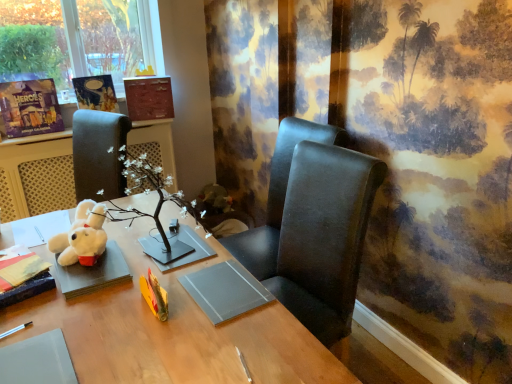
Find the location of a particular element. This screenshot has height=384, width=512. white plush toy at left is located at coordinates (74, 165).

What do you see at coordinates (74, 165) in the screenshot? The height and width of the screenshot is (384, 512). I see `white plush toy at left` at bounding box center [74, 165].

In the scene shown: What is the approximate height of black leather chair at center, which is counted as the 1th chair, starting from the bottom?

The height of black leather chair at center, which is counted as the 1th chair, starting from the bottom, is 3.40 feet.

Describe the element at coordinates (96, 93) in the screenshot. Image resolution: width=512 pixels, height=384 pixels. I see `matte paper book at upper left, the second book positioned from the top` at that location.

Identify the location of wooden desk at center. The image size is (512, 384). (173, 331).

Find the location of a particular element. Image resolution: width=512 pixels, height=384 pixels. white plush toy at left is located at coordinates (74, 165).

From a real-world perspective, is matte black book at lower left, which ranks as the fourth book in top-to-bottom order, over white plush toy at left?

Yes.

Based on their sizes in the image, would you say matte black book at lower left, which is the 1th book from bottom to top, is bigger or smaller than white plush toy at left?

In the image, matte black book at lower left, which is the 1th book from bottom to top, appears to be smaller than white plush toy at left.

From the image's perspective, is matte black book at lower left, which ranks as the fourth book in top-to-bottom order, below white plush toy at left?

Yes, from the image's perspective, matte black book at lower left, which ranks as the fourth book in top-to-bottom order, is below white plush toy at left.

Measure the distance between matte black book at lower left, which is the 1th book from bottom to top, and white plush toy at left.

matte black book at lower left, which is the 1th book from bottom to top, is 1.62 meters from white plush toy at left.

Is black leather chair at center, which is counted as the 1th chair, starting from the bottom, to the right of white plush toy at lower left from the viewer's perspective?

Yes, black leather chair at center, which is counted as the 1th chair, starting from the bottom, is to the right of white plush toy at lower left.

From the image's perspective, which is above, black leather chair at center, acting as the second chair starting from the top, or white plush toy at lower left?

white plush toy at lower left is shown above in the image.

Find the location of `toy that is behind the black leather chair at center, which is counted as the 1th chair, starting from the bottom`. toy that is behind the black leather chair at center, which is counted as the 1th chair, starting from the bottom is located at coordinates (81, 235).

Is black leather chair at center, acting as the second chair starting from the top, shorter than white plush toy at lower left?

In fact, black leather chair at center, acting as the second chair starting from the top, may be taller than white plush toy at lower left.

From a real-world perspective, is matte black chair at center, which is the second chair in bottom-to-top order, on wooden desk at center?

Correct, in the physical world, matte black chair at center, which is the second chair in bottom-to-top order, is higher than wooden desk at center.

From the image's perspective, count 2nd chairs upward from the wooden desk at center and point to it. Please provide its 2D coordinates.

[(278, 196)]

Is the depth of matte black chair at center, which is the second chair in bottom-to-top order, greater than that of wooden desk at center?

Yes, it is.

Is matte black chair at center, which is the second chair in bottom-to-top order, oriented towards wooden desk at center?

Yes, matte black chair at center, which is the second chair in bottom-to-top order, is aimed at wooden desk at center.

I want to click on toy located on the left of matte black chair at center, which is the 1th chair in top-to-bottom order, so click(x=81, y=235).

Considering the positions of points (98, 247) and (274, 164), is point (98, 247) farther from camera compared to point (274, 164)?

No, (98, 247) is in front of (274, 164).

Would you say white plush toy at lower left is outside matte black chair at center, which is the second chair in bottom-to-top order?

Yes, white plush toy at lower left is not within matte black chair at center, which is the second chair in bottom-to-top order.

From the image's perspective, relative to matte black chair at center, which is the second chair in bottom-to-top order, is white plush toy at lower left above or below?

white plush toy at lower left is situated lower than matte black chair at center, which is the second chair in bottom-to-top order, in the image.

Can you confirm if matte paper book at upper left, which is counted as the second book, starting from the back, is shorter than white plush toy at lower left?

No, matte paper book at upper left, which is counted as the second book, starting from the back, is not shorter than white plush toy at lower left.

Considering the points (103, 101) and (101, 238), which point is in front, point (103, 101) or point (101, 238)?

The point (101, 238) is closer to the camera.

Is matte paper book at upper left, arranged as the 3th book when viewed from the front, oriented towards white plush toy at lower left?

Yes, matte paper book at upper left, arranged as the 3th book when viewed from the front, faces towards white plush toy at lower left.

In the scene shown: Looking at their sizes, would you say matte paper book at upper left, which is counted as the second book, starting from the back, is wider or thinner than white plush toy at lower left?

In the image, matte paper book at upper left, which is counted as the second book, starting from the back, appears to be more narrow than white plush toy at lower left.

Is black leather chair at center, which is counted as the 1th chair, starting from the bottom, closer to the viewer compared to white plush toy at left?

Yes, it is.

Is black leather chair at center, acting as the second chair starting from the top, looking in the opposite direction of white plush toy at left?

No, black leather chair at center, acting as the second chair starting from the top, is not facing the opposite direction of white plush toy at left.

Locate an element on the screen. The image size is (512, 384). table located above the black leather chair at center, which is counted as the 1th chair, starting from the bottom (from a real-world perspective) is located at coordinates (74, 165).

Considering the relative sizes of black leather chair at center, acting as the second chair starting from the top, and white plush toy at left in the image provided, is black leather chair at center, acting as the second chair starting from the top, taller than white plush toy at left?

Correct, black leather chair at center, acting as the second chair starting from the top, is much taller as white plush toy at left.

Consider the image. Considering the relative positions of wooden desk at center and matte black book at lower left, arranged as the 1th book when viewed from the front, in the image provided, is wooden desk at center to the left or to the right of matte black book at lower left, arranged as the 1th book when viewed from the front,?

In the image, wooden desk at center appears on the right side of matte black book at lower left, arranged as the 1th book when viewed from the front.

In the scene shown: Is wooden desk at center next to matte black book at lower left, which is the 1th book from bottom to top?

wooden desk at center is not next to matte black book at lower left, which is the 1th book from bottom to top, and they're not touching.

Is wooden desk at center positioned with its back to matte black book at lower left, acting as the 4th book starting from the back?

No.

Locate an element on the screen. table directly beneath the matte black book at lower left, arranged as the 1th book when viewed from the front (from a real-world perspective) is located at coordinates (74, 165).

Starting from the white plush toy at lower left, which chair is the 2nd one to the right? Please provide its 2D coordinates.

[(324, 236)]

Based on their spatial positions, is white plush toy at lower left or matte black book at lower left, which is the 1th book from bottom to top, closer to wooden desk at center?

white plush toy at lower left.

Considering their positions, is matte paper book at upper left, arranged as the 3th book when viewed from the front, positioned closer to white plush toy at lower left than matte cardboard book at upper left, arranged as the third book when viewed from the back?

Among the two, matte cardboard book at upper left, arranged as the third book when viewed from the back, is located nearer to white plush toy at lower left.

From the image, which object appears to be nearer to white plush toy at left, black leather chair at center, which is counted as the 1th chair, starting from the bottom, or white plush toy at lower left?

white plush toy at lower left.

Estimate the real-world distances between objects in this image. Which object is closer to matte black chair at center, which is the 1th chair in top-to-bottom order, matte paper book at upper left, which is counted as the second book, starting from the back, or matte black book at lower left, which ranks as the fourth book in top-to-bottom order?

matte black book at lower left, which ranks as the fourth book in top-to-bottom order, is positioned closer to the anchor matte black chair at center, which is the 1th chair in top-to-bottom order.

From the image, which object appears to be farther from black leather chair at center, which is counted as the 1th chair, starting from the bottom, white plush toy at left or wooden desk at center?

Based on the image, white plush toy at left appears to be further to black leather chair at center, which is counted as the 1th chair, starting from the bottom.

Looking at the image, which one is located further to matte black chair at center, which is the second chair in bottom-to-top order, matte brown book at upper center, the first book viewed from the back, or black leather chair at center, acting as the second chair starting from the top?

Based on the image, matte brown book at upper center, the first book viewed from the back, appears to be further to matte black chair at center, which is the second chair in bottom-to-top order.

Based on their spatial positions, is matte brown book at upper center, the 4th book from the bottom, or black leather chair at center, acting as the second chair starting from the top, closer to matte paper book at upper left, the second book positioned from the top?

matte brown book at upper center, the 4th book from the bottom.

In the scene shown: Looking at the image, which one is located closer to matte cardboard book at upper left, marked as the second book in a front-to-back arrangement, white plush toy at lower left or black leather chair at center, acting as the second chair starting from the top?

Based on the image, white plush toy at lower left appears to be nearer to matte cardboard book at upper left, marked as the second book in a front-to-back arrangement.

At what (x,y) coordinates should I click in order to perform the action: click on chair between matte black book at lower left, arranged as the 1th book when viewed from the front, and matte paper book at upper left, which is counted as the 3th book, starting from the bottom, in the front-back direction. Please return your answer as a coordinate pair (x, y). Looking at the image, I should click on (278, 196).

Find the location of a particular element. toy between matte black book at lower left, acting as the 4th book starting from the back, and matte paper book at upper left, which is counted as the second book, starting from the back, from front to back is located at coordinates (81, 235).

Image resolution: width=512 pixels, height=384 pixels. In order to click on table located between matte black book at lower left, acting as the 4th book starting from the back, and matte brown book at upper center, the first book viewed from the back, in the depth direction in this screenshot , I will do `click(74, 165)`.

You are a GUI agent. You are given a task and a screenshot of the screen. Output one action in this format:
    pyautogui.click(x=<x>, y=<y>)
    Task: Click on the toy between wooden desk at center and matte cardboard book at upper left, arranged as the third book when viewed from the back, along the z-axis
    
    Given the screenshot: What is the action you would take?
    pyautogui.click(x=81, y=235)